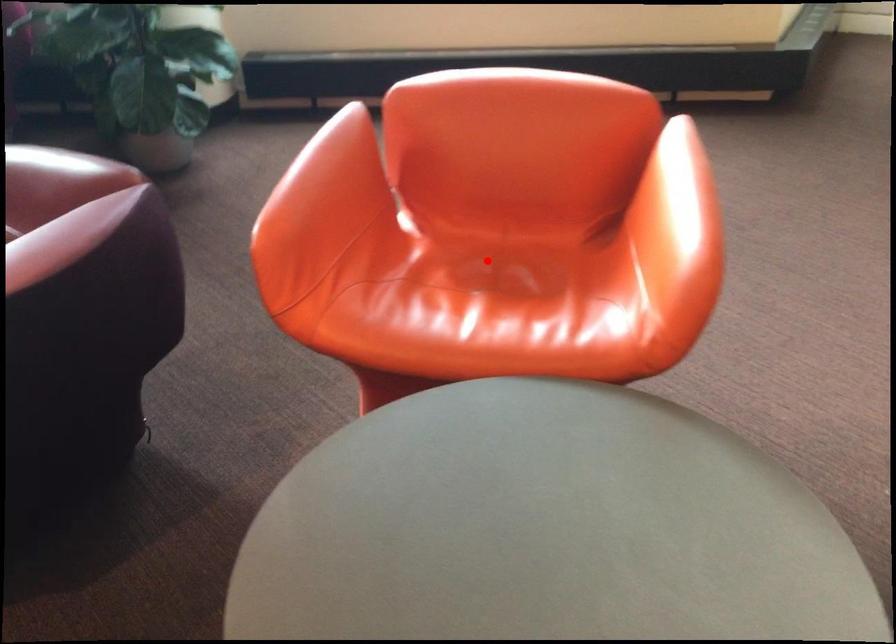
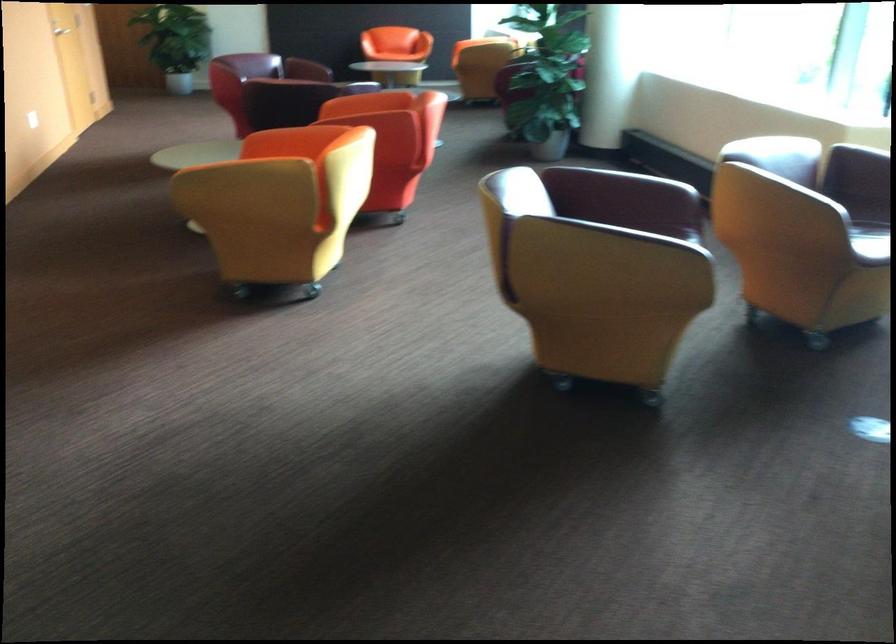
Question: I am providing you with two images of the same scene from different viewpoints. A red point is marked on the first image. Can you still see the location of the red point in image 2?

Choices:
 (A) Yes
 (B) No

Answer: (B)